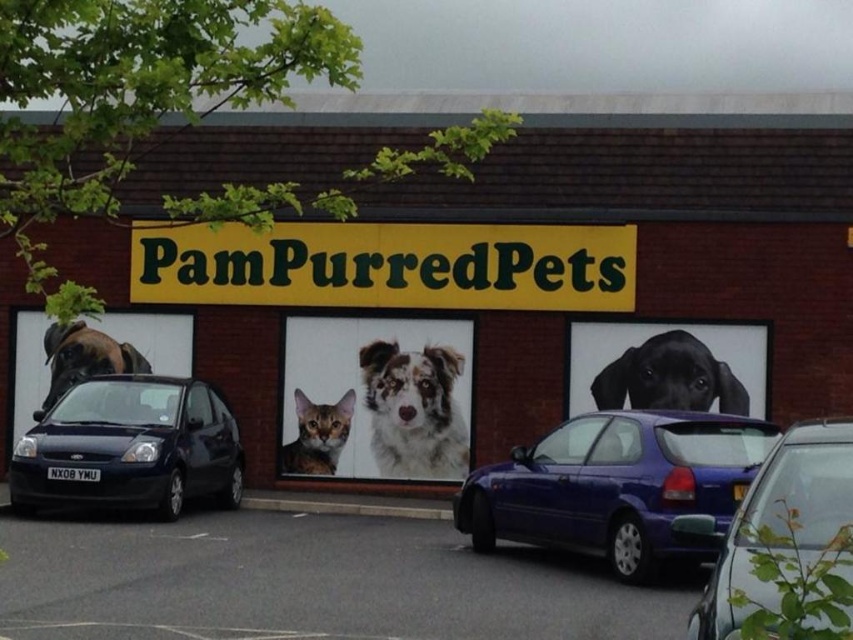
You are a delivery person who needs to park your van in front of the PamPurredPets store. You see the gray asphalt at lower center and the matte black hatchback at lower left. Which parking spot is available for your van if the hatchback is already occupying its spot?

The gray asphalt at lower center is available because it is to the right of the matte black hatchback at lower left, indicating it is an adjacent spot not occupied by the hatchback.